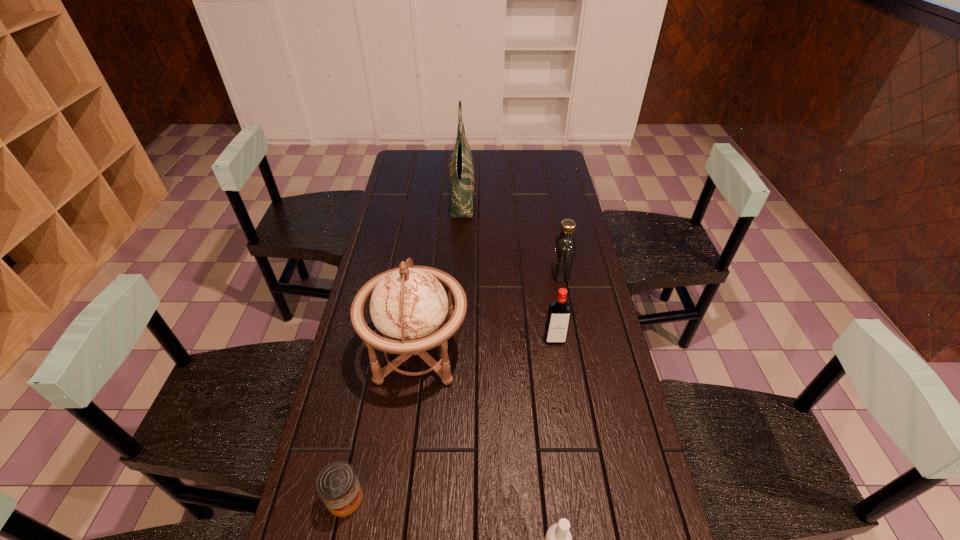
Identify the location of vodka identified as the second closest to the can. The height and width of the screenshot is (540, 960). (559, 312).

The width and height of the screenshot is (960, 540). I want to click on vacant space that satisfies the following two spatial constraints: 1. at the front of the globe showing Africa; 2. on the front side of the can, so click(398, 499).

The image size is (960, 540). I want to click on vacant space that satisfies the following two spatial constraints: 1. on the front-facing side of the second farthest object; 2. on the front and back of the second farthest vodka, so click(573, 340).

Locate an element on the screen. This screenshot has height=540, width=960. blank area in the image that satisfies the following two spatial constraints: 1. on the front and back of the second farthest vodka; 2. at the front of the globe showing Africa is located at coordinates (557, 353).

What are the coordinates of `free space that satisfies the following two spatial constraints: 1. on the front side of the tote bag; 2. at the front of the globe showing Africa` in the screenshot? It's located at (453, 353).